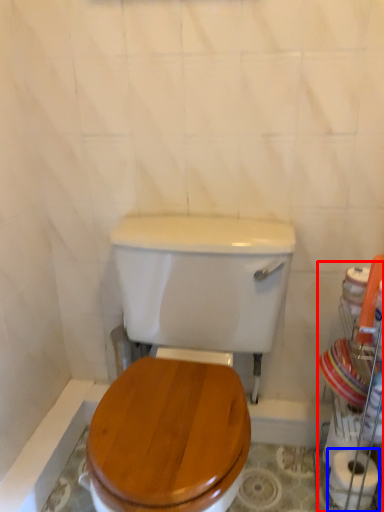
Question: Which of the following is the farthest to the observer, porcelain (highlighted by a red box) or toilet paper (highlighted by a blue box)?

Choices:
 (A) porcelain
 (B) toilet paper

Answer: (B)